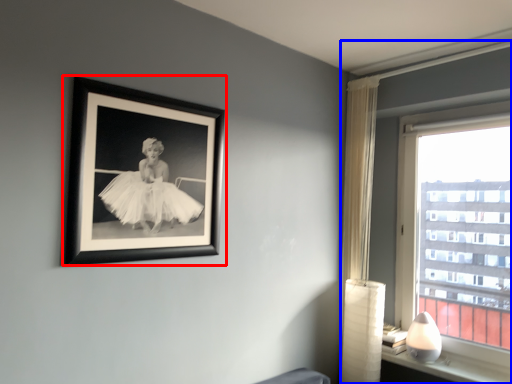
Question: Which object appears closest to the camera in this image, picture frame (highlighted by a red box) or window (highlighted by a blue box)?

Choices:
 (A) picture frame
 (B) window

Answer: (A)